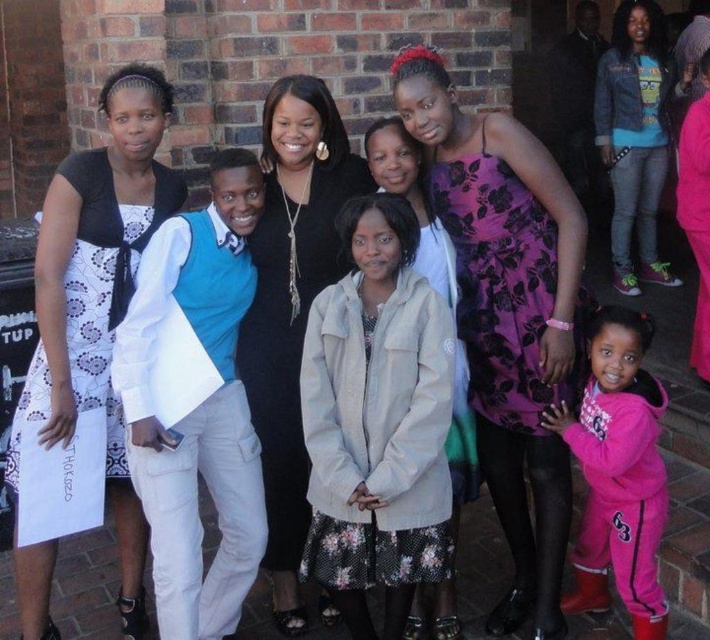
Question: Where is white lace dress at left located in relation to matte black dress at center in the image?

Choices:
 (A) below
 (B) above

Answer: (B)

Question: Observing the image, what is the correct spatial positioning of purple floral dress at center in reference to white lace dress at left?

Choices:
 (A) right
 (B) left

Answer: (A)

Question: Based on their relative distances, which object is nearer to the purple floral dress at center?

Choices:
 (A) white lace dress at left
 (B) denim jacket at upper right
 (C) beige fleece jacket at center
 (D) pink fleece jacket at lower right

Answer: (D)

Question: Which object is the closest to the denim jacket at upper right?

Choices:
 (A) beige fleece jacket at center
 (B) pink fleece jacket at lower right
 (C) matte black dress at center

Answer: (B)

Question: Which object is the closest to the denim jacket at upper right?

Choices:
 (A) beige fleece jacket at center
 (B) pink fleece jacket at lower right
 (C) white lace dress at left

Answer: (B)

Question: Does white lace dress at left appear under denim jacket at upper right?

Choices:
 (A) no
 (B) yes

Answer: (B)